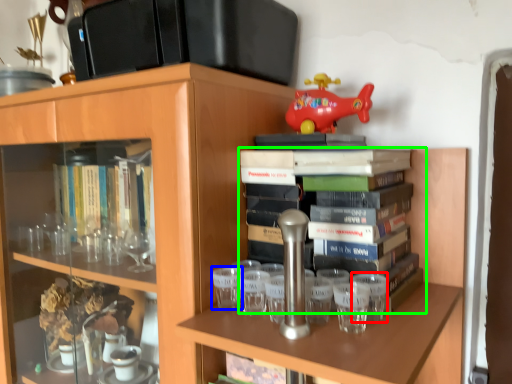
Question: Estimate the real-world distances between objects in this image. Which object is closer to shot glass (highlighted by a red box), shot glass (highlighted by a blue box) or book (highlighted by a green box)?

Choices:
 (A) shot glass
 (B) book

Answer: (B)